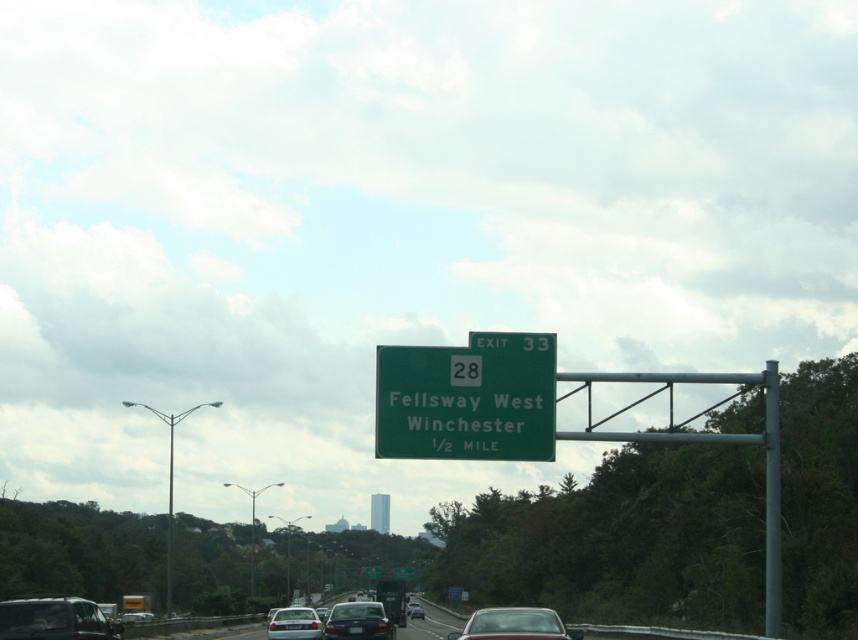
Question: Which of the following is the closest to the observer?

Choices:
 (A) green metallic sign at upper center
 (B) white glossy sedan at center

Answer: (B)

Question: Which object is closer to the camera taking this photo?

Choices:
 (A) matte silver sedan at center
 (B) silver metallic sedan at center
 (C) white glossy sedan at center
 (D) green metallic sign at upper center

Answer: (A)

Question: Does white glossy sedan at center appear on the left side of silver metallic sedan at center?

Choices:
 (A) yes
 (B) no

Answer: (A)

Question: From the image, what is the correct spatial relationship of metallic gray sedan at lower left in relation to green metallic sign at upper center?

Choices:
 (A) right
 (B) left

Answer: (A)

Question: Does green matte sign at center appear under metallic gray sedan at lower left?

Choices:
 (A) yes
 (B) no

Answer: (B)

Question: Which point is farther to the camera?

Choices:
 (A) white glossy sedan at center
 (B) metallic gray sedan at lower left

Answer: (A)